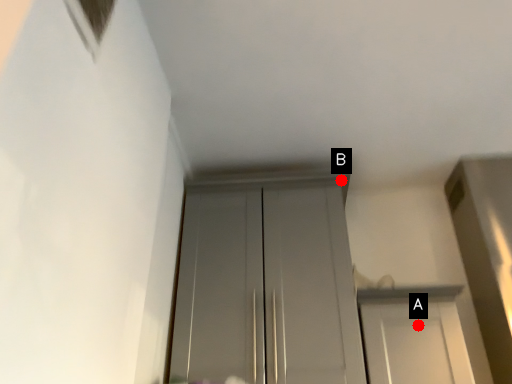
Question: Two points are circled on the image, labeled by A and B beside each circle. Among these points, which one is nearest to the camera?

Choices:
 (A) A is closer
 (B) B is closer

Answer: (A)